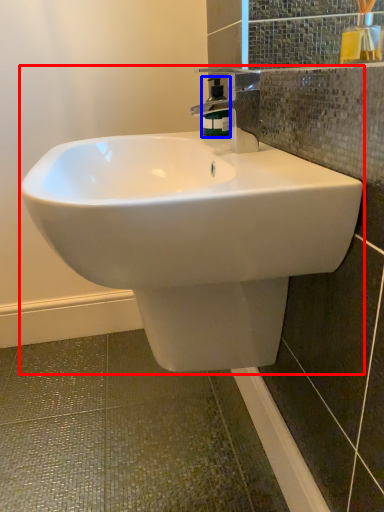
Question: Which point is closer to the camera, sink (highlighted by a red box) or soap dispenser (highlighted by a blue box)?

Choices:
 (A) sink
 (B) soap dispenser

Answer: (A)